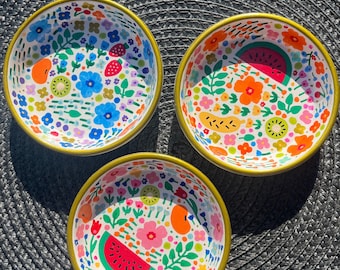
I want to click on right bowl, so click(x=257, y=93).